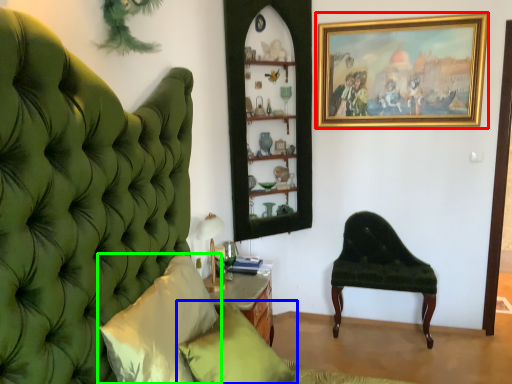
Question: Considering the real-world distances, which object is closest to picture frame (highlighted by a red box)? pillow (highlighted by a blue box) or pillow (highlighted by a green box).

Choices:
 (A) pillow
 (B) pillow

Answer: (A)